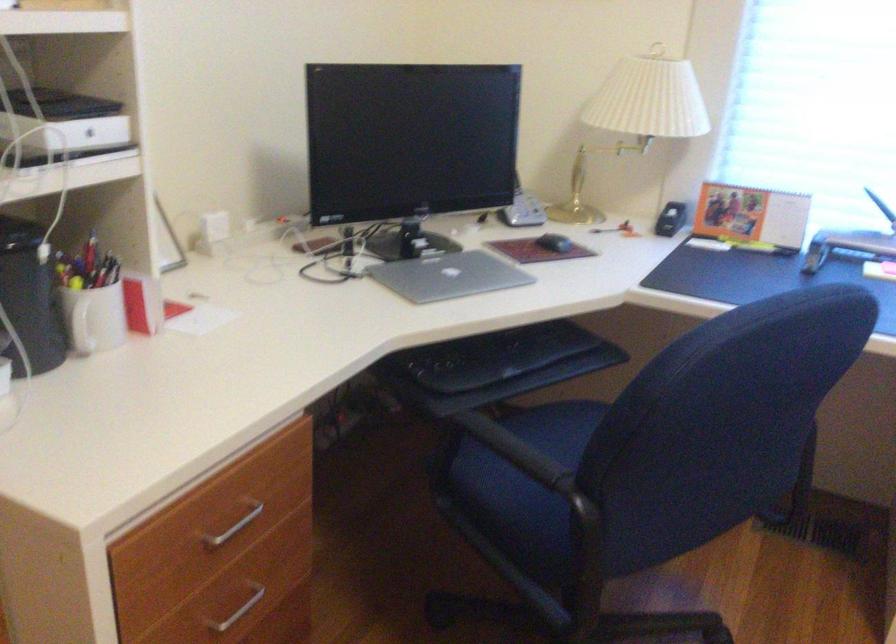
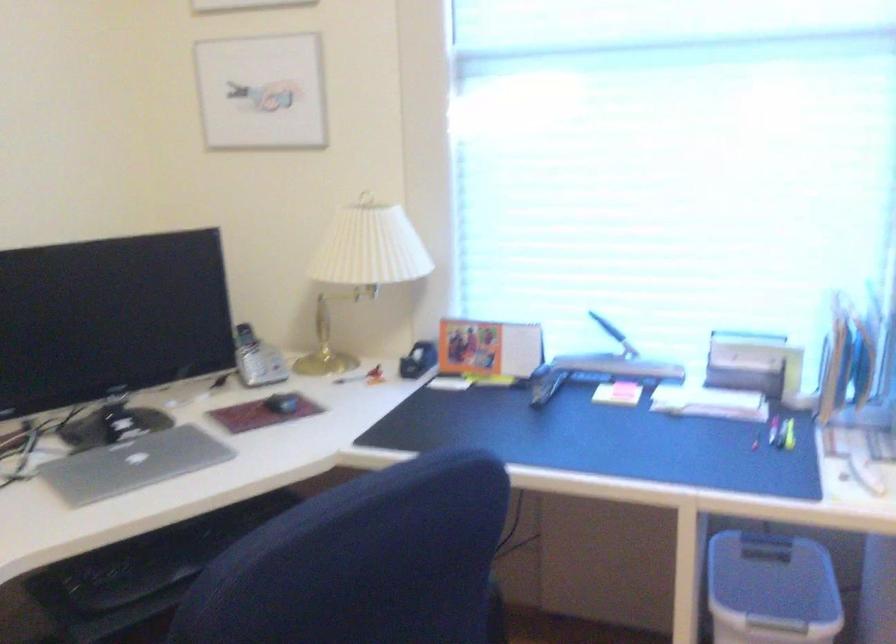
Find the pixel in the second image that matches (560,242) in the first image.

(281, 402)